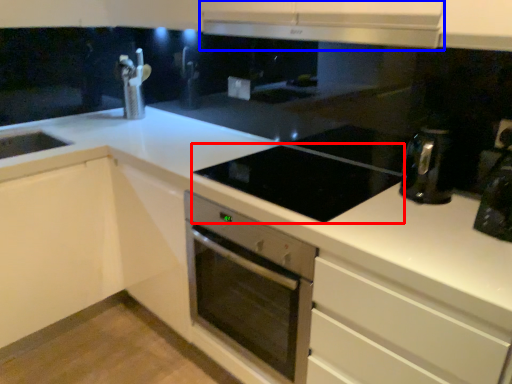
Question: Which object appears closest to the camera in this image, gas stove (highlighted by a red box) or exhaust hood (highlighted by a blue box)?

Choices:
 (A) gas stove
 (B) exhaust hood

Answer: (B)